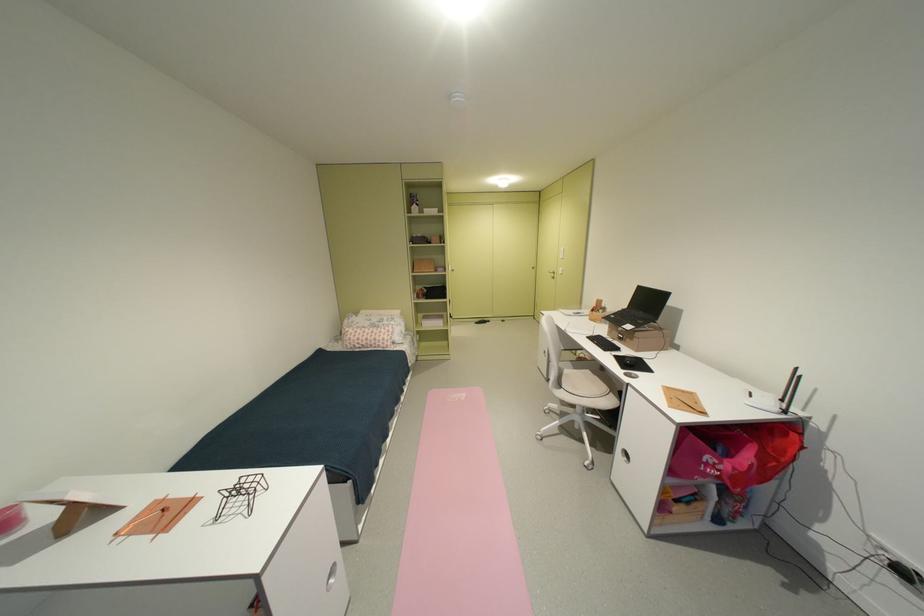
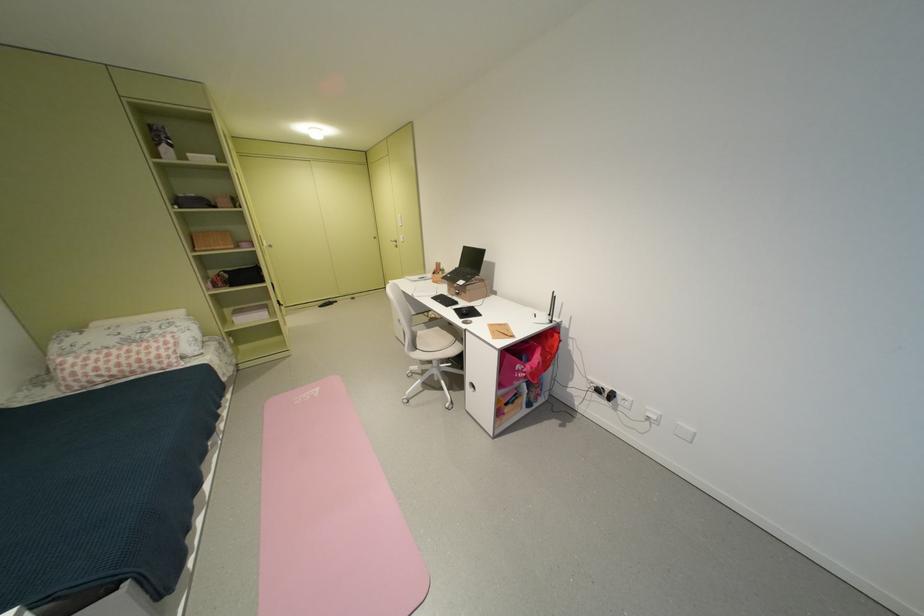
Where in the second image is the point corresponding to point (388, 342) from the first image?

(159, 362)